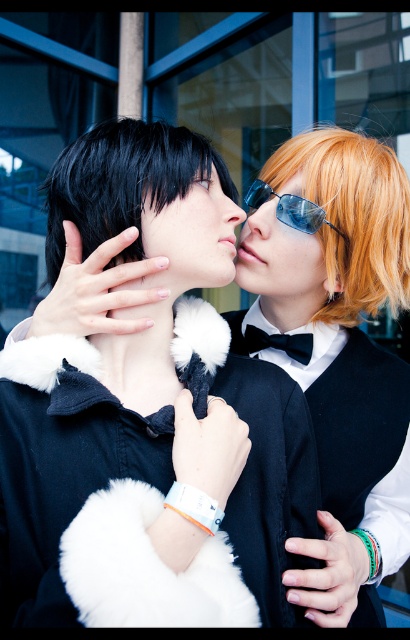
Question: Does matte black fur collar at center have a smaller size compared to smooth skin nose at center?

Choices:
 (A) yes
 (B) no

Answer: (B)

Question: Which of these objects is positioned closest to the translucent plastic nose at center?

Choices:
 (A) black matte forehead at upper center
 (B) matte black sunglasses at upper center
 (C) blue reflective glasses at center
 (D) matte black fur collar at center

Answer: (C)

Question: Which point is closer to the camera?

Choices:
 (A) matte black fur collar at center
 (B) smooth skin nose at center

Answer: (A)

Question: Where is shiny orange wig at center located in relation to black matte forehead at upper center in the image?

Choices:
 (A) right
 (B) left

Answer: (A)

Question: Among these objects, which one is nearest to the camera?

Choices:
 (A) translucent plastic nose at center
 (B) blue reflective glasses at center
 (C) shiny orange wig at center
 (D) black matte hair at upper center

Answer: (D)

Question: Is matte black fur collar at center to the right of matte black sunglasses at upper center from the viewer's perspective?

Choices:
 (A) yes
 (B) no

Answer: (B)